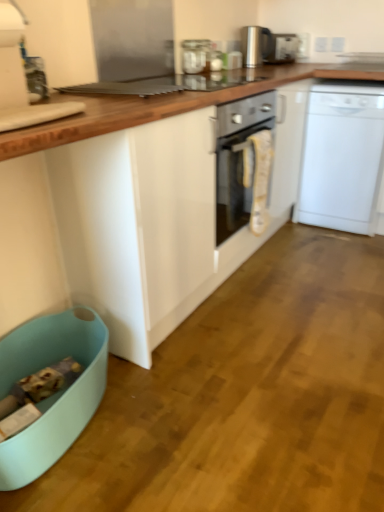
The width and height of the screenshot is (384, 512). I want to click on white glossy cabinet at center, so click(x=165, y=205).

This screenshot has width=384, height=512. Describe the element at coordinates (55, 393) in the screenshot. I see `light blue plastic dish washer at lower left` at that location.

The height and width of the screenshot is (512, 384). What do you see at coordinates (342, 157) in the screenshot?
I see `white plastic dishwasher at right` at bounding box center [342, 157].

At what (x,y) coordinates should I click in order to perform the action: click on white glossy cabinet at center. Please return your answer as a coordinate pair (x, y). Looking at the image, I should click on (165, 205).

Is polished stainless steel kettle at upper center, positioned as the 1th kitchen appliance in right-to-left order, positioned behind satin silver toaster at upper center?

No, polished stainless steel kettle at upper center, positioned as the 1th kitchen appliance in right-to-left order, is in front of satin silver toaster at upper center.

Is point (251, 48) less distant than point (288, 49)?

Yes.

Is polished stainless steel kettle at upper center, the 2th kitchen appliance from the left, thinner than satin silver toaster at upper center?

Incorrect, the width of polished stainless steel kettle at upper center, the 2th kitchen appliance from the left, is not less than that of satin silver toaster at upper center.

From a real-world perspective, is polished stainless steel kettle at upper center, which appears as the first kitchen appliance when viewed from the top, located higher than satin silver toaster at upper center?

Indeed, from a real-world perspective, polished stainless steel kettle at upper center, which appears as the first kitchen appliance when viewed from the top, stands above satin silver toaster at upper center.

Can you confirm if white glossy cabinet at center is taller than white plastic dishwasher at right?

Yes.

Could white plastic dishwasher at right be considered to be inside white glossy cabinet at center?

Yes, white plastic dishwasher at right is surrounded by white glossy cabinet at center.

From a real-world perspective, who is located higher, white glossy cabinet at center or white plastic dishwasher at right?

white glossy cabinet at center is physically above.

From the image's perspective, is white glossy cabinet at center under white plastic dishwasher at right?

Indeed, from the image's perspective, white glossy cabinet at center is shown beneath white plastic dishwasher at right.

Between light blue plastic dish washer at lower left and satin silver toaster at upper center, which one has smaller width?

satin silver toaster at upper center.

Would you consider light blue plastic dish washer at lower left to be distant from satin silver toaster at upper center?

Absolutely, light blue plastic dish washer at lower left is distant from satin silver toaster at upper center.

Considering the sizes of objects light blue plastic dish washer at lower left and satin silver toaster at upper center in the image provided, who is bigger, light blue plastic dish washer at lower left or satin silver toaster at upper center?

Bigger between the two is light blue plastic dish washer at lower left.

Considering the relative sizes of light blue plastic dish washer at lower left and satin silver toaster at upper center in the image provided, is light blue plastic dish washer at lower left taller than satin silver toaster at upper center?

Yes, light blue plastic dish washer at lower left is taller than satin silver toaster at upper center.

Looking at this image, is white plastic dishwasher at right in contact with light blue plastic dish washer at lower left?

There is a gap between white plastic dishwasher at right and light blue plastic dish washer at lower left.

Based on their sizes in the image, would you say white plastic dishwasher at right is bigger or smaller than light blue plastic dish washer at lower left?

Considering their sizes, white plastic dishwasher at right takes up more space than light blue plastic dish washer at lower left.

From a real-world perspective, is white plastic dishwasher at right under light blue plastic dish washer at lower left?

No, from a real-world perspective, white plastic dishwasher at right is not under light blue plastic dish washer at lower left.

Considering the sizes of objects white plastic dishwasher at right and light blue plastic dish washer at lower left in the image provided, who is taller, white plastic dishwasher at right or light blue plastic dish washer at lower left?

Standing taller between the two is white plastic dishwasher at right.

Is white plastic dishwasher at right located outside white glossy cabinet at center?

No, most part of white plastic dishwasher at right lies within white glossy cabinet at center.

Is white plastic dishwasher at right turned away from white glossy cabinet at center?

Yes, white plastic dishwasher at right is positioned with its back facing white glossy cabinet at center.

From the picture: Is white plastic dishwasher at right far from white glossy cabinet at center?

Actually, white plastic dishwasher at right and white glossy cabinet at center are a little close together.

In the scene shown: In terms of width, does satin silver toaster at upper center look wider or thinner when compared to polished stainless steel kettle at upper center, which appears as the first kitchen appliance when viewed from the top?

Considering their sizes, satin silver toaster at upper center looks slimmer than polished stainless steel kettle at upper center, which appears as the first kitchen appliance when viewed from the top.

Is satin silver toaster at upper center positioned far away from polished stainless steel kettle at upper center, which appears as the first kitchen appliance when viewed from the top?

satin silver toaster at upper center is near polished stainless steel kettle at upper center, which appears as the first kitchen appliance when viewed from the top, not far away.

From the image's perspective, which is above, satin silver toaster at upper center or polished stainless steel kettle at upper center, the second kitchen appliance in the front-to-back sequence?

satin silver toaster at upper center, from the image's perspective.

How different are the orientations of satin silver toaster at upper center and polished stainless steel kettle at upper center, which appears as the first kitchen appliance when viewed from the top, in degrees?

satin silver toaster at upper center and polished stainless steel kettle at upper center, which appears as the first kitchen appliance when viewed from the top, are facing 50.5 degrees away from each other.

Can you confirm if satin silver toaster at upper center is positioned to the left of clear glass jar at upper center, which appears as the 1th kitchen appliance when viewed from the front?

No, satin silver toaster at upper center is not to the left of clear glass jar at upper center, which appears as the 1th kitchen appliance when viewed from the front.

From the picture: Is the surface of satin silver toaster at upper center in direct contact with clear glass jar at upper center, which is the second kitchen appliance from back to front?

No, satin silver toaster at upper center is not in contact with clear glass jar at upper center, which is the second kitchen appliance from back to front.

Can you confirm if satin silver toaster at upper center is bigger than clear glass jar at upper center, the first kitchen appliance when ordered from bottom to top?

Correct, satin silver toaster at upper center is larger in size than clear glass jar at upper center, the first kitchen appliance when ordered from bottom to top.

Looking at their sizes, would you say satin silver toaster at upper center is wider or thinner than clear glass jar at upper center, the second kitchen appliance in the right-to-left sequence?

Clearly, satin silver toaster at upper center has more width compared to clear glass jar at upper center, the second kitchen appliance in the right-to-left sequence.

This screenshot has width=384, height=512. In the image, there is a polished stainless steel kettle at upper center, which appears as the first kitchen appliance when viewed from the top. What are the coordinates of `appliance below it (from a real-world perspective)` in the screenshot? It's located at (282, 49).

Where is `home appliance on the right of white glossy cabinet at center`? home appliance on the right of white glossy cabinet at center is located at coordinates (342, 157).

Looking at the image, which one is located further to white plastic dishwasher at right, satin silver toaster at upper center or polished stainless steel kettle at upper center, positioned as the 1th kitchen appliance in right-to-left order?

polished stainless steel kettle at upper center, positioned as the 1th kitchen appliance in right-to-left order.

When comparing their distances from white glossy cabinet at center, does satin silver toaster at upper center or light blue plastic dish washer at lower left seem closer?

light blue plastic dish washer at lower left is closer to white glossy cabinet at center.

Consider the image. From the image, which object appears to be farther from white plastic dishwasher at right, light blue plastic dish washer at lower left or white glossy cabinet at center?

light blue plastic dish washer at lower left is further to white plastic dishwasher at right.

From the image, which object appears to be nearer to clear glass jar at upper center, which appears as the 1th kitchen appliance when viewed from the front, light blue plastic dish washer at lower left or white glossy cabinet at center?

Among the two, white glossy cabinet at center is located nearer to clear glass jar at upper center, which appears as the 1th kitchen appliance when viewed from the front.

Looking at the image, which one is located further to polished stainless steel kettle at upper center, positioned as the 1th kitchen appliance in right-to-left order, satin silver toaster at upper center or clear glass jar at upper center, which is the second kitchen appliance from back to front?

clear glass jar at upper center, which is the second kitchen appliance from back to front, is further to polished stainless steel kettle at upper center, positioned as the 1th kitchen appliance in right-to-left order.

Which object lies nearer to the anchor point light blue plastic dish washer at lower left, satin silver toaster at upper center or polished stainless steel kettle at upper center, the 2th kitchen appliance from the left?

polished stainless steel kettle at upper center, the 2th kitchen appliance from the left, is closer to light blue plastic dish washer at lower left.

Estimate the real-world distances between objects in this image. Which object is further from white glossy cabinet at center, light blue plastic dish washer at lower left or polished stainless steel kettle at upper center, which appears as the first kitchen appliance when viewed from the top?

polished stainless steel kettle at upper center, which appears as the first kitchen appliance when viewed from the top, lies further to white glossy cabinet at center than the other object.

Based on the photo, looking at the image, which one is located further to light blue plastic dish washer at lower left, satin silver toaster at upper center or white plastic dishwasher at right?

Among the two, satin silver toaster at upper center is located further to light blue plastic dish washer at lower left.

This screenshot has height=512, width=384. What are the coordinates of `home appliance positioned between white glossy cabinet at center and polished stainless steel kettle at upper center, which appears as the first kitchen appliance when viewed from the top, from near to far` in the screenshot? It's located at (342, 157).

Locate an element on the screen. The width and height of the screenshot is (384, 512). home appliance between satin silver toaster at upper center and light blue plastic dish washer at lower left vertically is located at coordinates (342, 157).

Identify the location of kitchen appliance between polished stainless steel kettle at upper center, acting as the first kitchen appliance starting from the back, and light blue plastic dish washer at lower left from top to bottom. The height and width of the screenshot is (512, 384). (194, 55).

Find the location of a particular element. The image size is (384, 512). kitchen appliance between clear glass jar at upper center, the first kitchen appliance when ordered from bottom to top, and white plastic dishwasher at right, in the horizontal direction is located at coordinates (255, 44).